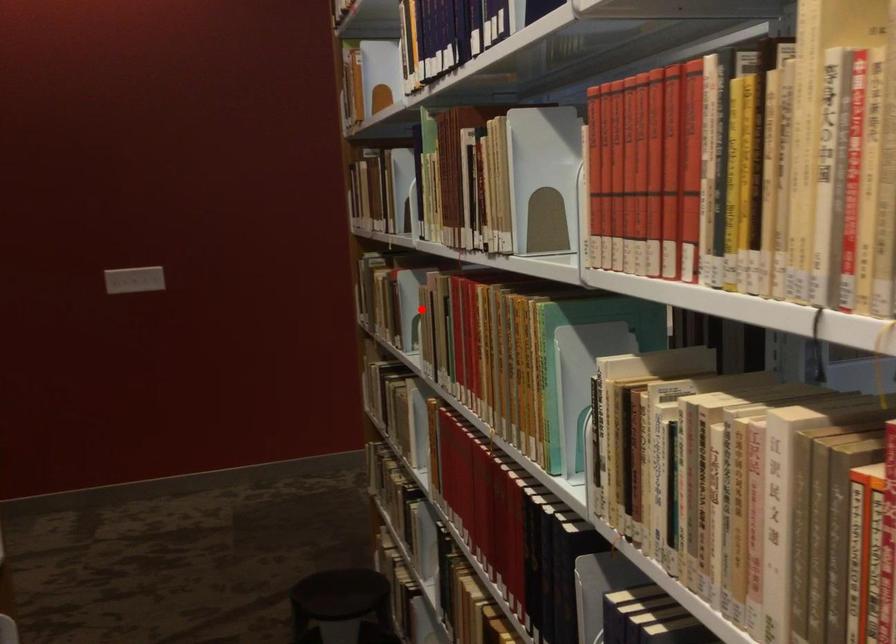
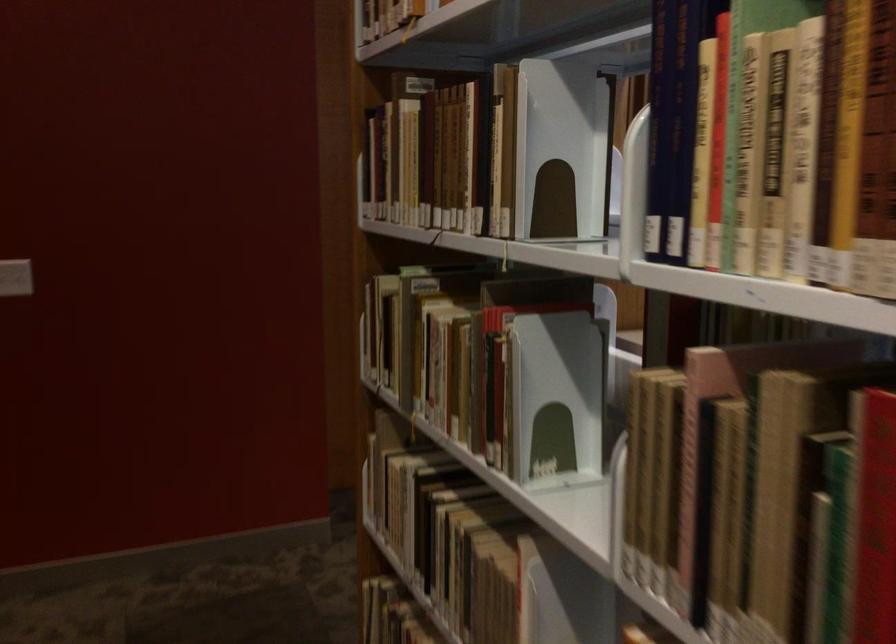
Question: I am providing you with two images of the same scene from different viewpoints. In image1, a red point is highlighted. Considering the same 3D point in image2, which of the following is correct?

Choices:
 (A) It is closer
 (B) It is farther

Answer: (A)